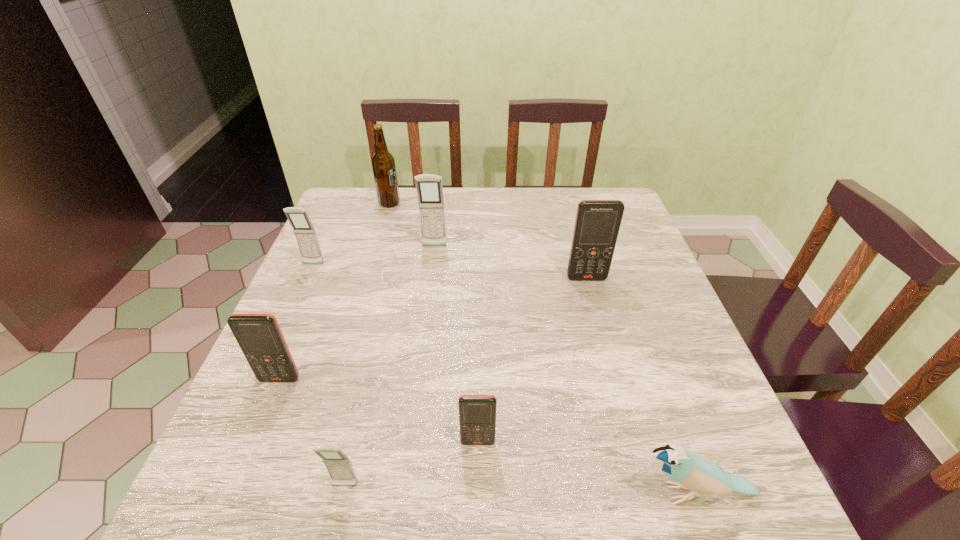
This screenshot has width=960, height=540. I want to click on bird, so click(687, 470).

In order to click on the nearest orange cellular telephone in this screenshot , I will do `click(477, 413)`.

What are the coordinates of `the second orange cellular telephone from right to left` in the screenshot? It's located at (477, 413).

This screenshot has width=960, height=540. In order to click on the smallest gray cellular telephone in this screenshot , I will do `click(338, 465)`.

Identify the location of the second gray cellular telephone from left to right. (338, 465).

Find the location of a particular element. The image size is (960, 540). free space located on the label of the farthest object is located at coordinates (465, 203).

At what (x,y) coordinates should I click in order to perform the action: click on vacant space situated 0.080m on the front-facing side of the second farthest object. Please return your answer as a coordinate pair (x, y). This screenshot has height=540, width=960. Looking at the image, I should click on (431, 269).

The width and height of the screenshot is (960, 540). In order to click on free space located on the screen of the biggest orange cellular telephone in this screenshot , I will do `click(611, 366)`.

The image size is (960, 540). In order to click on free space located 0.050m on the front-facing side of the second smallest gray cellular telephone in this screenshot , I will do `click(306, 280)`.

The height and width of the screenshot is (540, 960). In order to click on free point located 0.240m on the screen of the fourth farthest cellular telephone in this screenshot , I will do `click(225, 512)`.